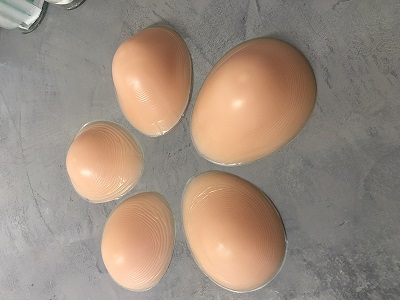
I want to click on counter, so click(330, 129).